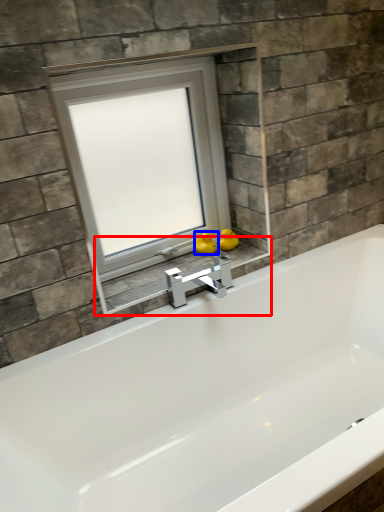
Question: Which point is closer to the camera, window sill (highlighted by a red box) or duck (highlighted by a blue box)?

Choices:
 (A) window sill
 (B) duck

Answer: (A)